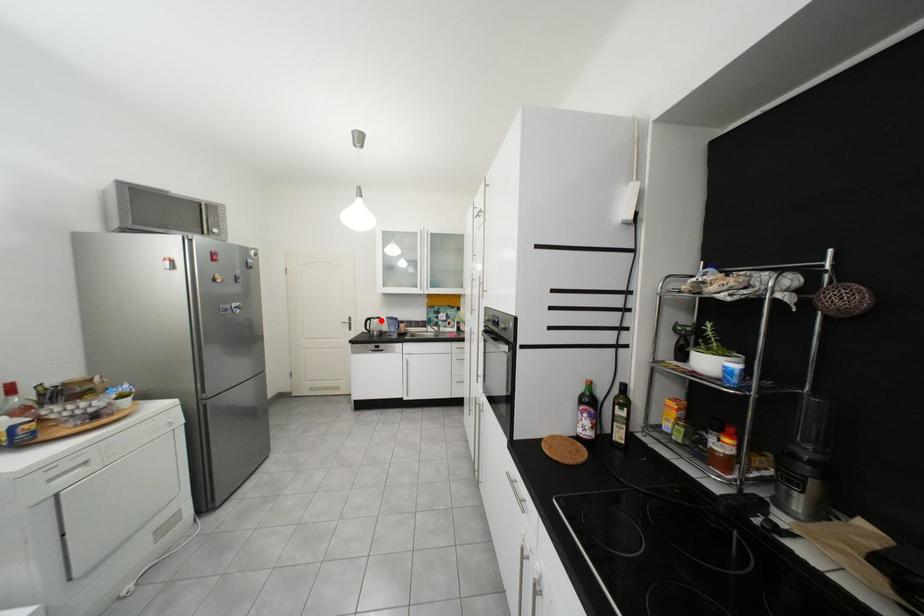
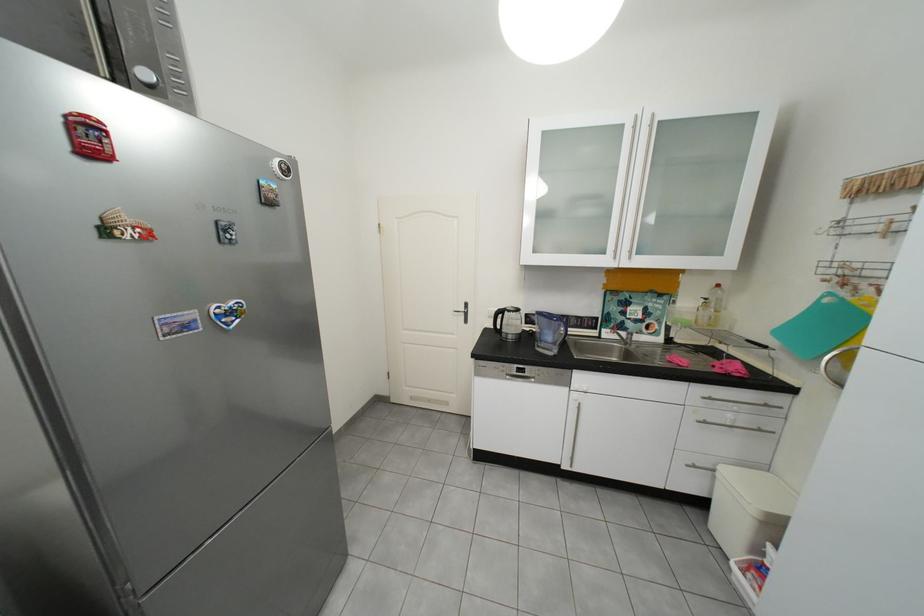
Question: I am providing you with two images of the same scene from different viewpoints. A red point is marked on the first image. Can you still see the location of the red point in image 2?

Choices:
 (A) Yes
 (B) No

Answer: (A)